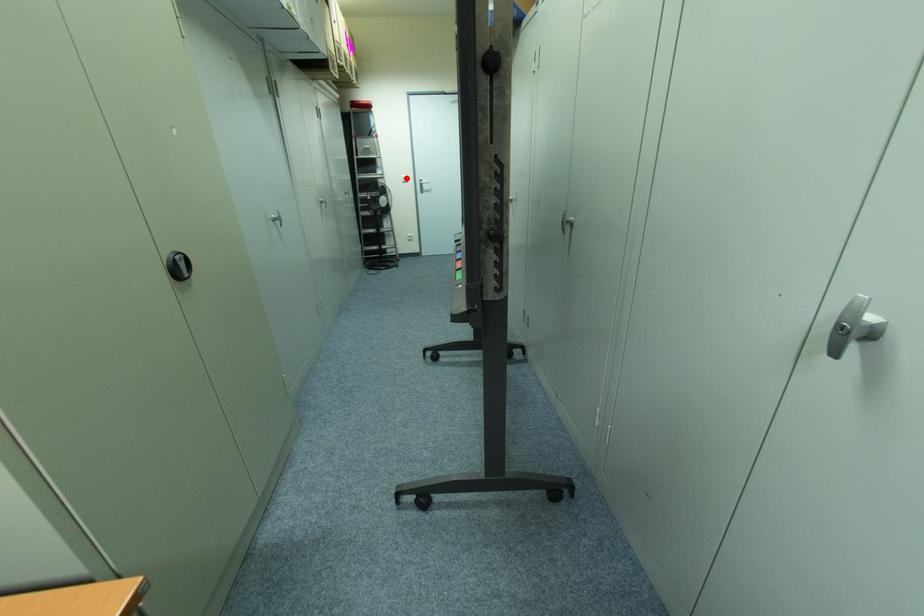
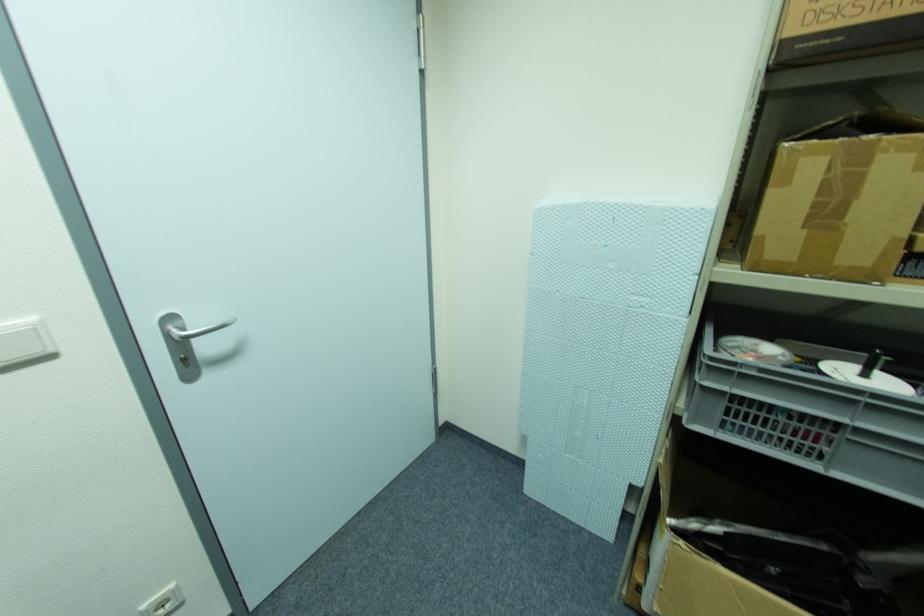
The point at the highlighted location is marked in the first image. Where is the corresponding point in the second image?

(34, 331)